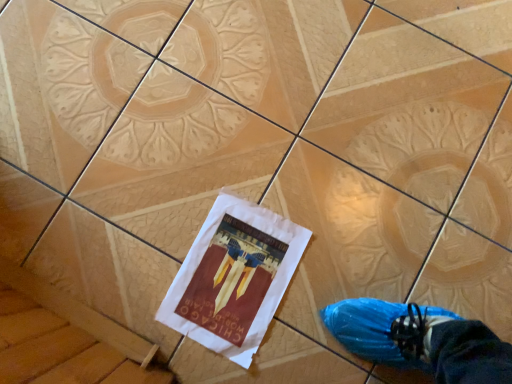
Find the location of a particular element. The height and width of the screenshot is (384, 512). free region on the left part of white paper postcard at lower left is located at coordinates (132, 244).